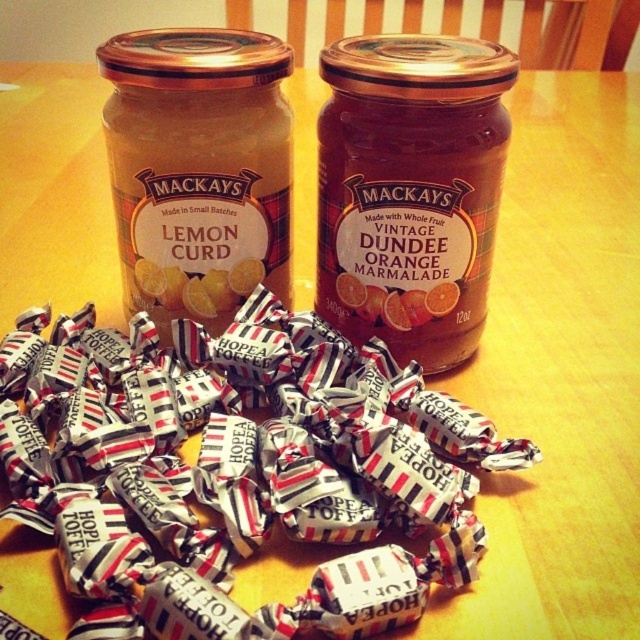
Question: Which object appears closest to the camera in this image?

Choices:
 (A) white striped paper wrapped toffee at center
 (B) matte glass jar at left

Answer: (A)

Question: Estimate the real-world distances between objects in this image. Which object is closer to the matte glass jar at center?

Choices:
 (A) matte glass jar at left
 (B) white striped paper wrapped toffee at center

Answer: (A)

Question: Does matte glass jar at center have a lesser width compared to matte glass jar at left?

Choices:
 (A) no
 (B) yes

Answer: (B)

Question: Is white striped paper wrapped toffee at center below matte glass jar at center?

Choices:
 (A) yes
 (B) no

Answer: (A)

Question: Which point appears closest to the camera in this image?

Choices:
 (A) (432, 305)
 (B) (280, 490)

Answer: (B)

Question: Is matte glass jar at center thinner than matte glass jar at left?

Choices:
 (A) yes
 (B) no

Answer: (A)